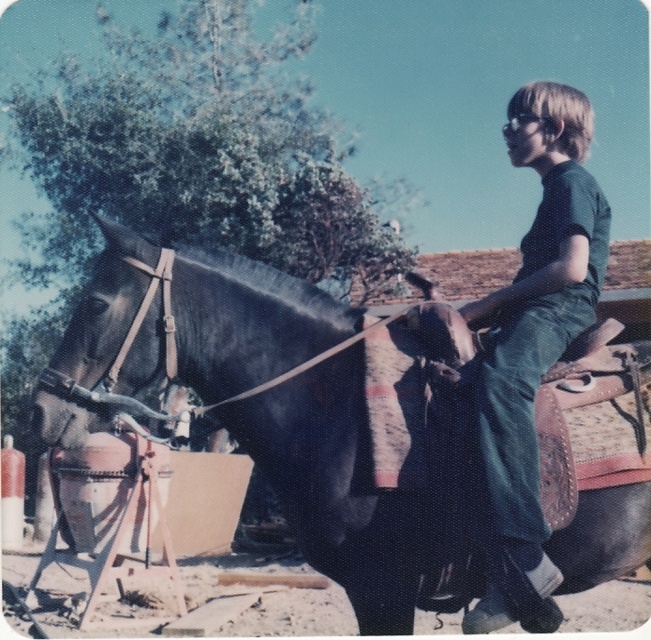
Which is in front, point (596, 336) or point (492, 595)?

Point (492, 595)

Does shiny black horse at center have a larger size compared to green denim pants at center?

Yes.

Looking at this image, who is more distant from viewer, (421,596) or (493,452)?

The point (421,596) is more distant.

Locate an element on the screen. The image size is (651, 640). shiny black horse at center is located at coordinates (380, 468).